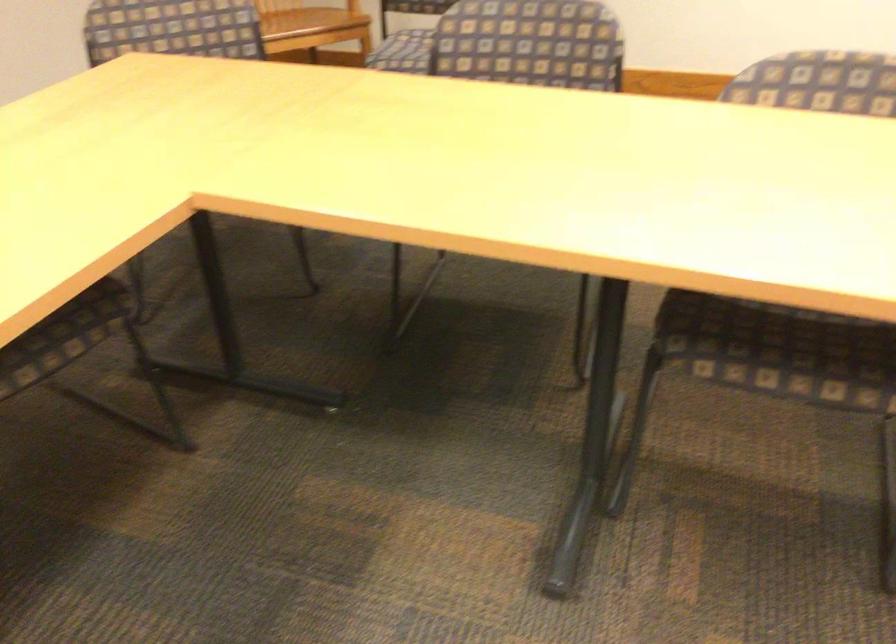
Locate an element on the screen. The width and height of the screenshot is (896, 644). wooden chair armrest is located at coordinates (352, 6).